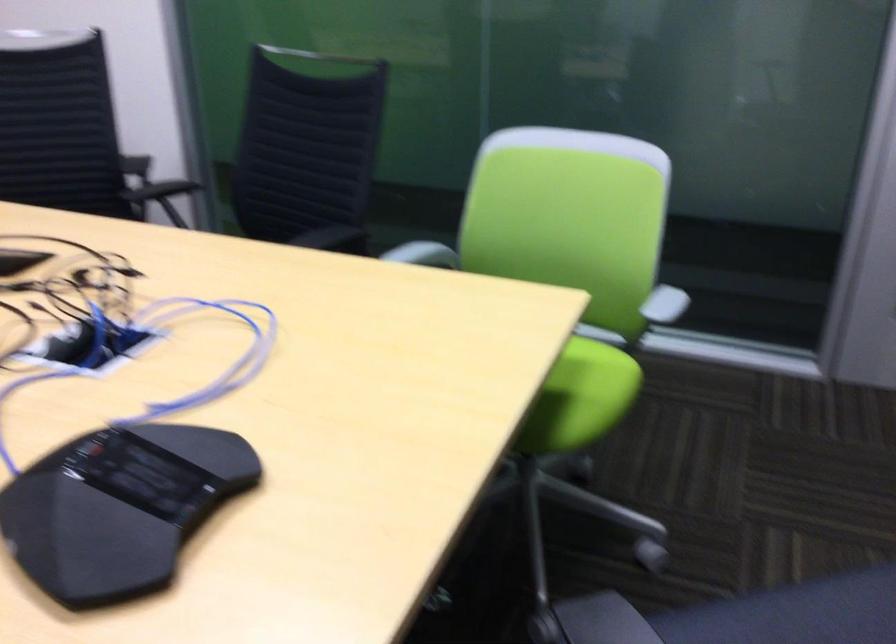
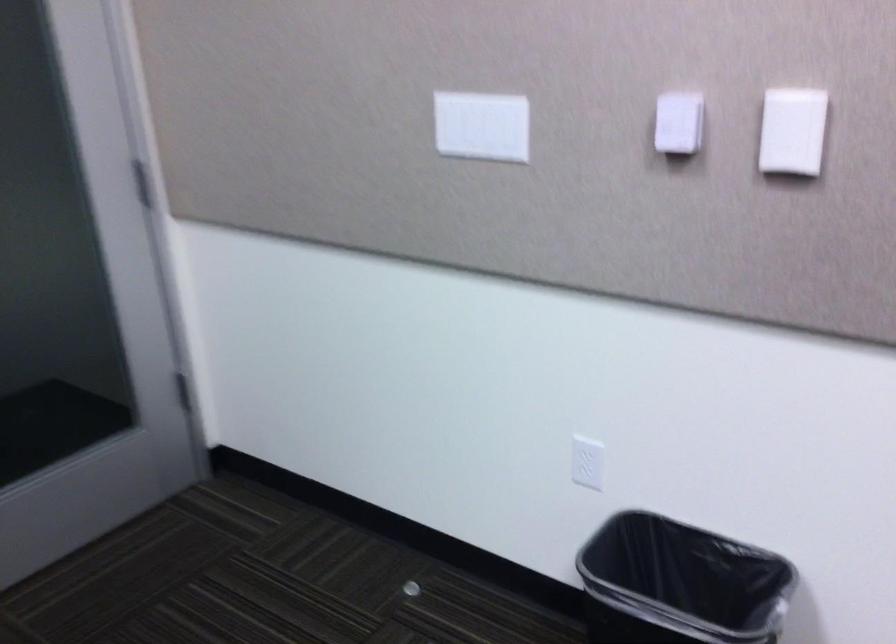
Question: Based on the continuous images, in which direction is the camera rotating? Reply with the corresponding letter.

Choices:
 (A) Left
 (B) Right
 (C) Up
 (D) Down

Answer: (B)